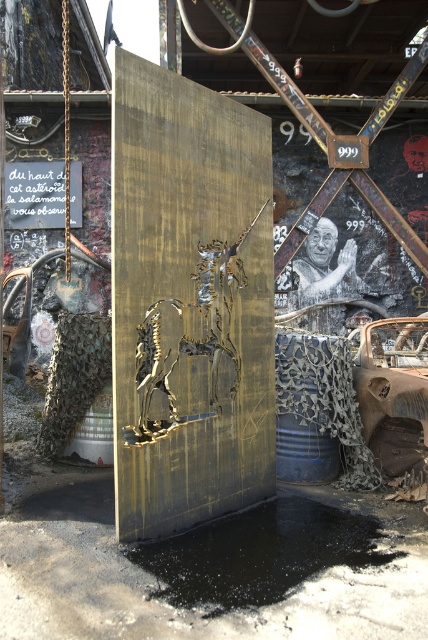
You are a delivery robot with a 3.5 feet wide package. You need to navigate from the black glossy puddle at lower center to the gold metallic horse at center. Can you safely pass between them without hitting the package on either side?

The distance between the black glossy puddle at lower center and the gold metallic horse at center is 3.84 feet. Since your package is 3.5 feet wide, there is enough space to pass safely as the distance is slightly larger than the package width.

You are standing in the middle of the scene and want to walk towards the rusty metal car at lower right. Which direction should you move relative to the gold metallic horse at center?

The gold metallic horse at center is to the left of the rusty metal car at lower right, so you should move to the right relative to the gold metallic horse at center to reach the rusty metal car at lower right.

You are standing in the urban environment and want to take a photo of both point (x=270, y=596) and point (x=184, y=392). Which point should you focus on first to ensure both are in clear view?

Point (x=270, y=596) is closer to the camera than point (x=184, y=392), so you should focus on point (x=270, y=596) first to ensure both are in clear view.